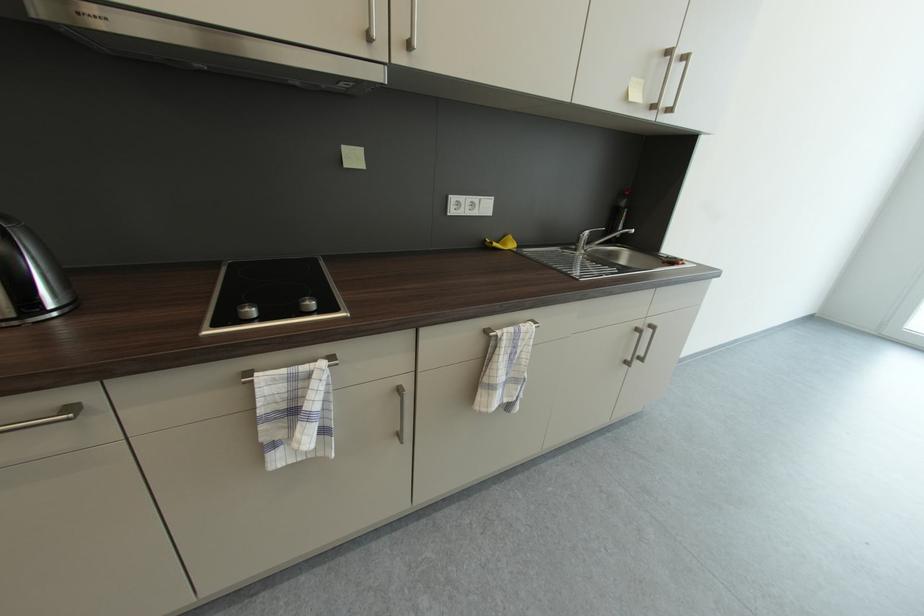
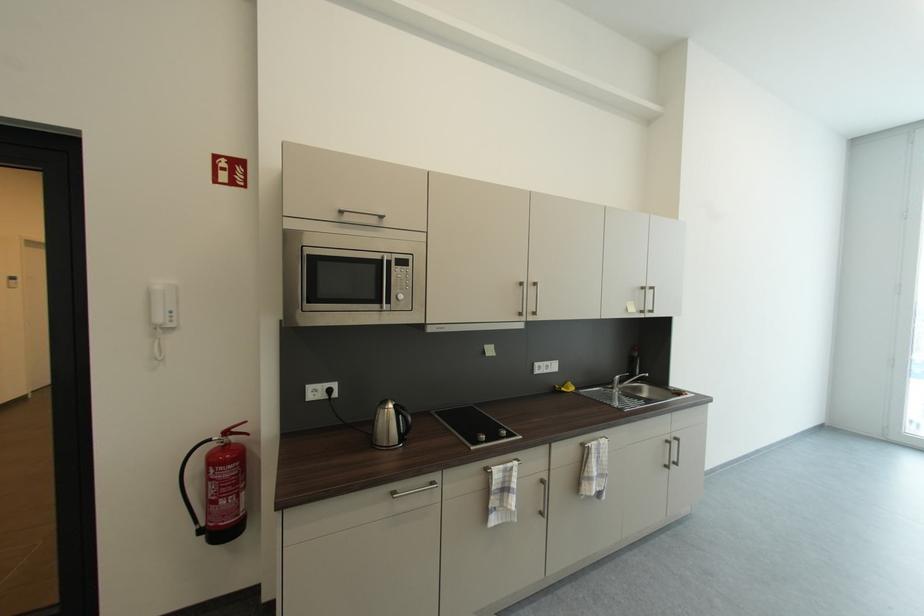
In the second image, find the point that corresponds to (584,241) in the first image.

(618, 383)